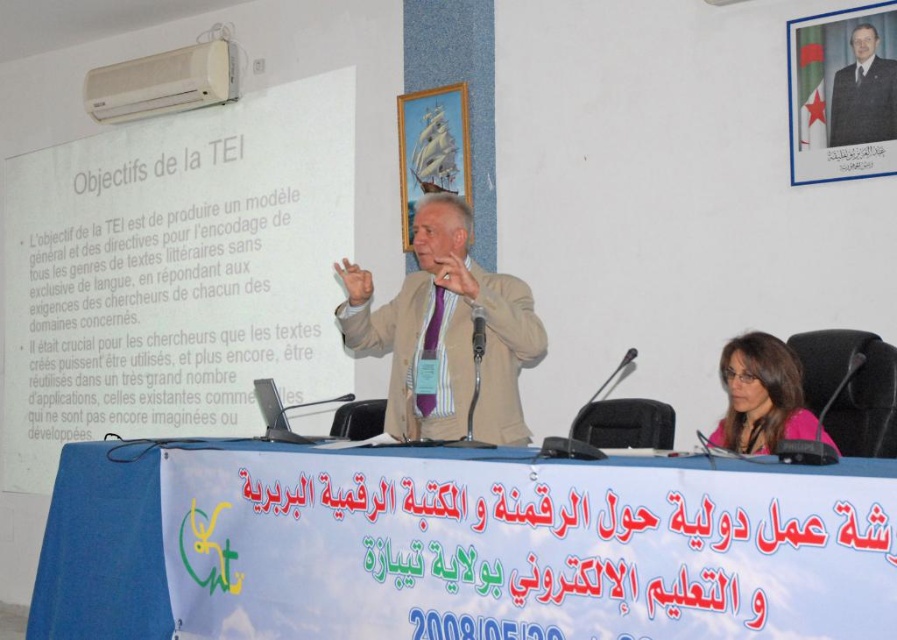
Question: Is white paper at upper center wider than beige fabric suit at center?

Choices:
 (A) yes
 (B) no

Answer: (A)

Question: Where is blue fabric banner at lower center located in relation to pink fabric at center in the image?

Choices:
 (A) below
 (B) above

Answer: (A)

Question: Which of the following is the farthest from the observer?

Choices:
 (A) beige fabric suit at center
 (B) blue fabric banner at lower center

Answer: (A)

Question: Among these points, which one is nearest to the camera?

Choices:
 (A) (292, 244)
 (B) (658, 534)
 (C) (745, 448)

Answer: (B)

Question: Which point appears closest to the camera in this image?

Choices:
 (A) (848, 125)
 (B) (721, 442)
 (C) (213, 422)
 (D) (547, 502)

Answer: (D)

Question: Can you confirm if white paper at upper center is smaller than pink fabric at center?

Choices:
 (A) no
 (B) yes

Answer: (A)